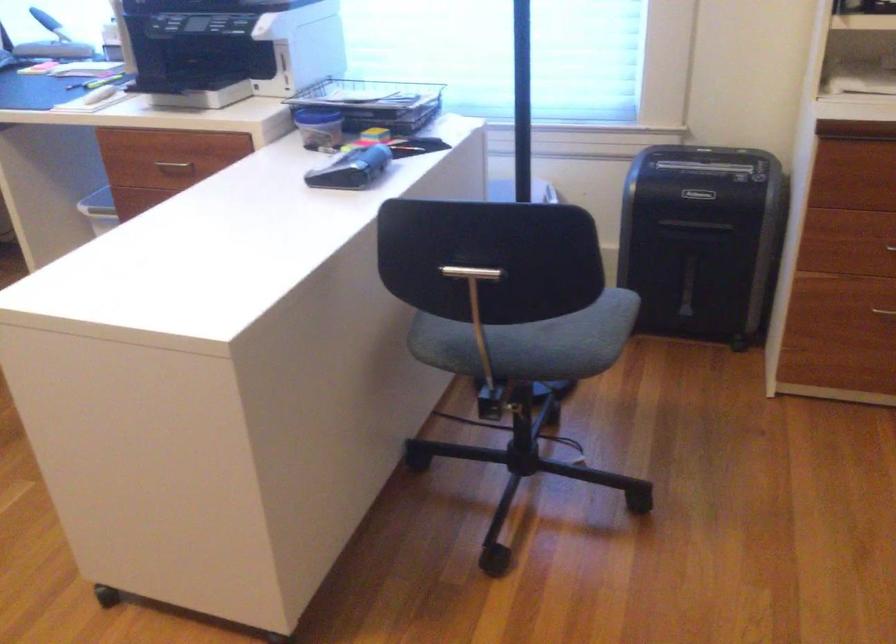
The image size is (896, 644). Describe the element at coordinates (531, 342) in the screenshot. I see `a chair sitting surface` at that location.